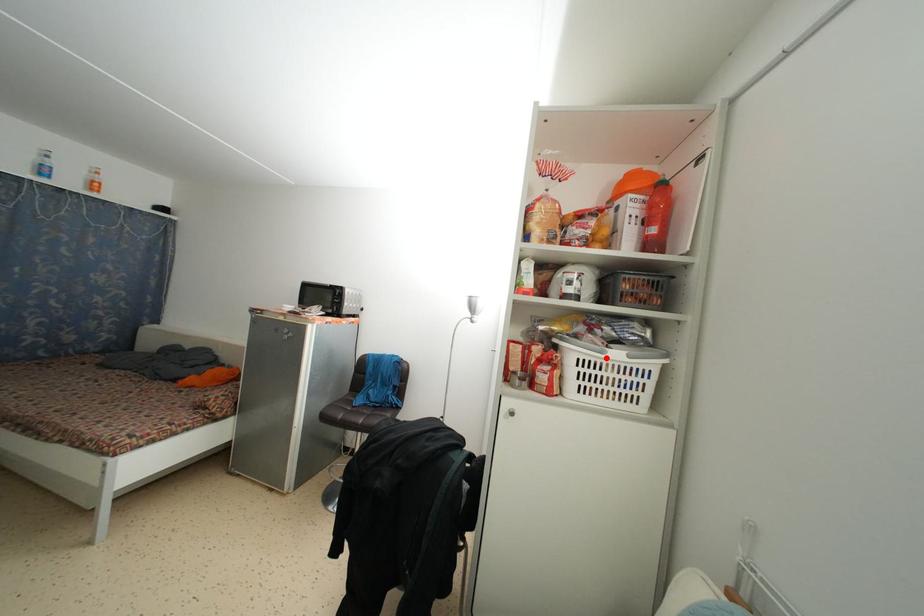
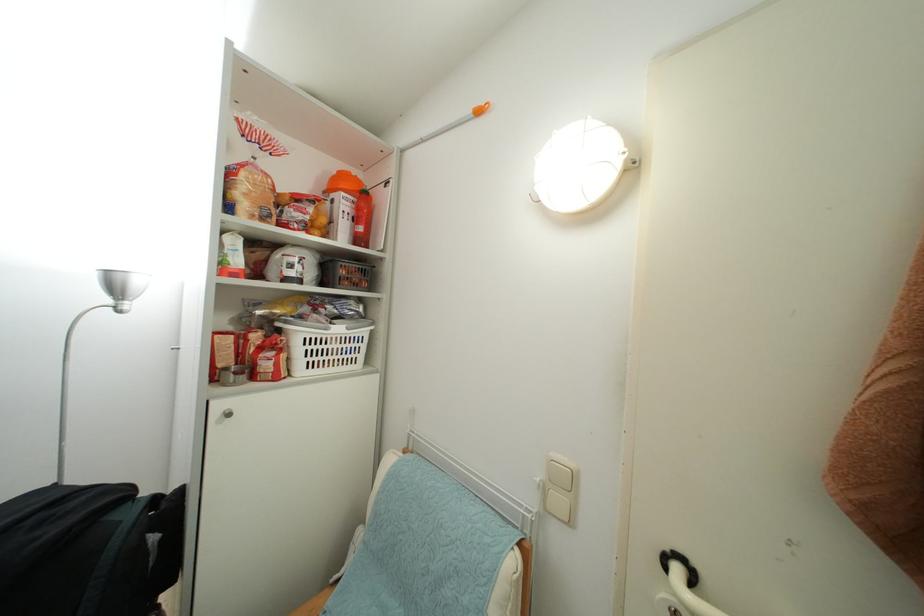
In the second image, find the point that corresponds to the highlighted location in the first image.

(331, 334)